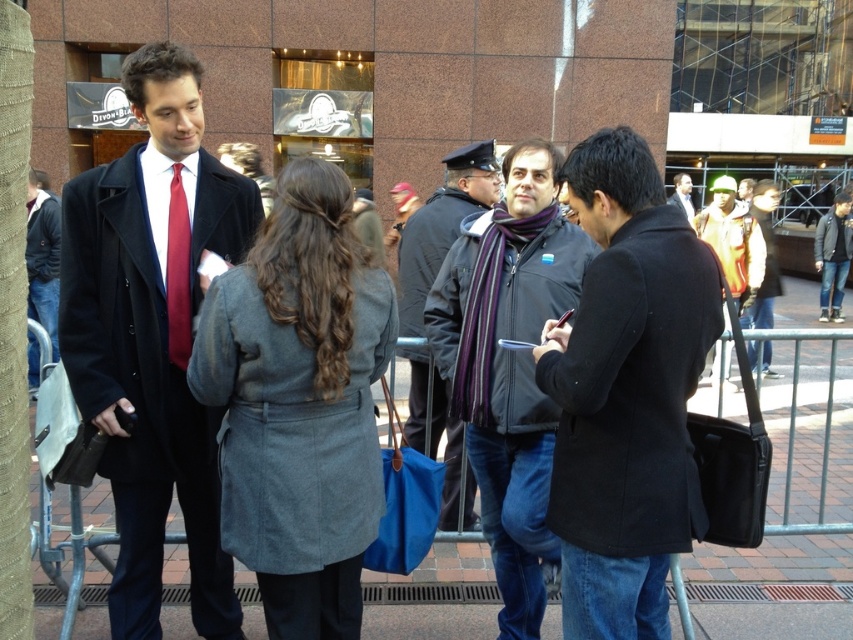
Question: Is gray wool coat at center to the left of striped wool scarf at center from the viewer's perspective?

Choices:
 (A) no
 (B) yes

Answer: (B)

Question: Where is yellow jacket at center located in relation to dark gray scarf at center in the image?

Choices:
 (A) above
 (B) below

Answer: (B)

Question: Which point is closer to the camera taking this photo?

Choices:
 (A) (518, 243)
 (B) (332, 336)

Answer: (B)

Question: Which point appears closest to the camera in this image?

Choices:
 (A) (38, 195)
 (B) (703, 316)
 (C) (830, 272)

Answer: (B)

Question: Observing the image, what is the correct spatial positioning of camouflage jacket at right in reference to dark gray scarf at center?

Choices:
 (A) left
 (B) right

Answer: (A)

Question: Which of the following is the closest to the observer?

Choices:
 (A) (173, 323)
 (B) (761, 204)
 (C) (677, 472)
 (D) (152, 138)

Answer: (C)